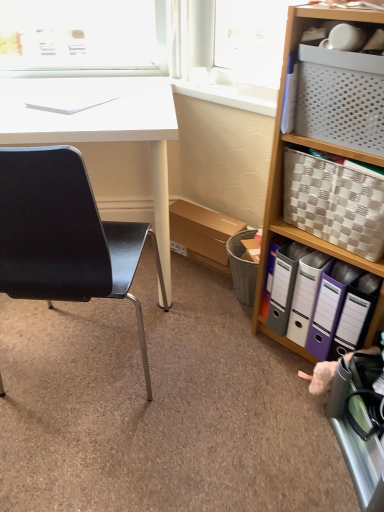
What are the coordinates of `vacant region above white plastic window sill at upper center (from a real-world perspective)` in the screenshot? It's located at (216, 88).